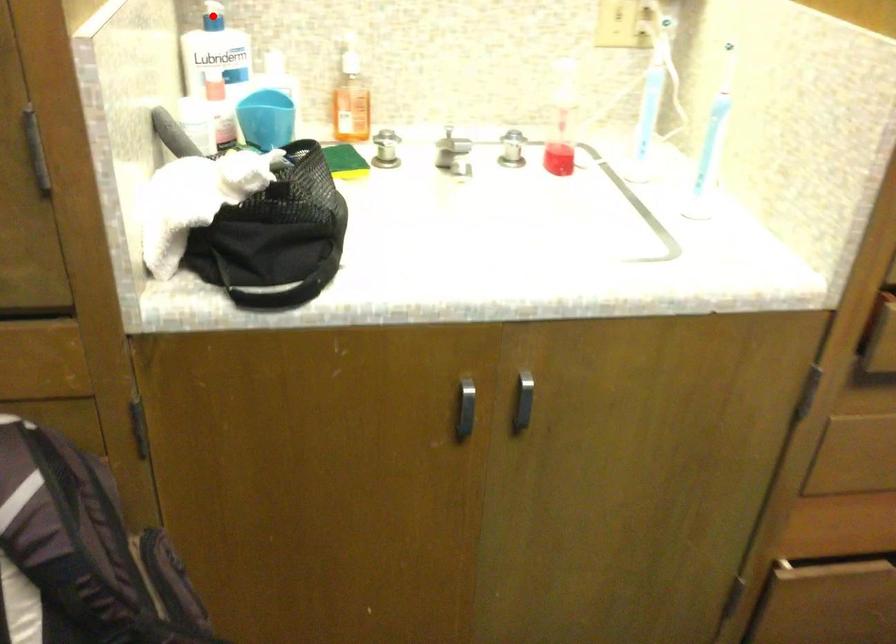
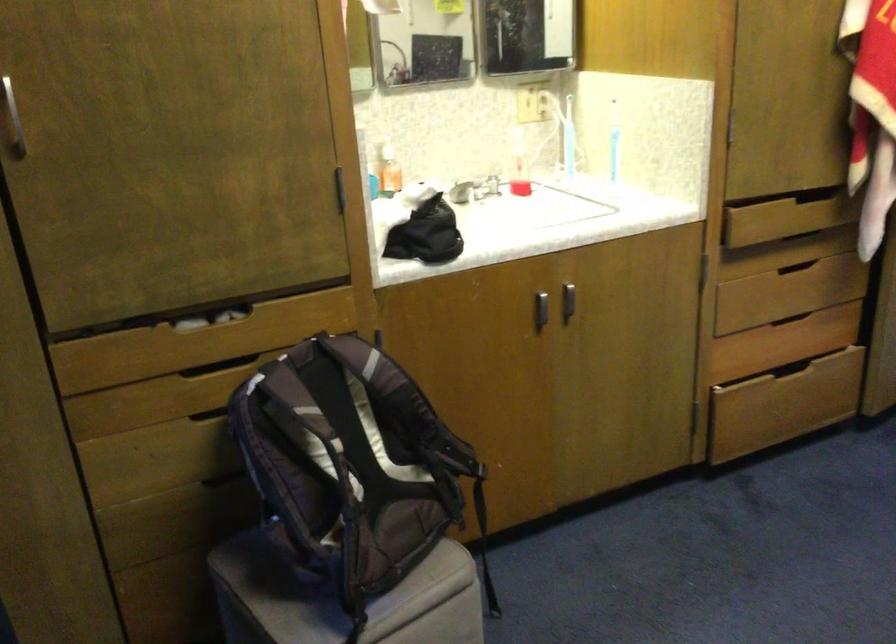
Question: I am providing you with two images of the same scene from different viewpoints. A red point is marked on the first image. At the location where the point appears in image 1, is it still visible in image 2?

Choices:
 (A) Yes
 (B) No

Answer: (B)